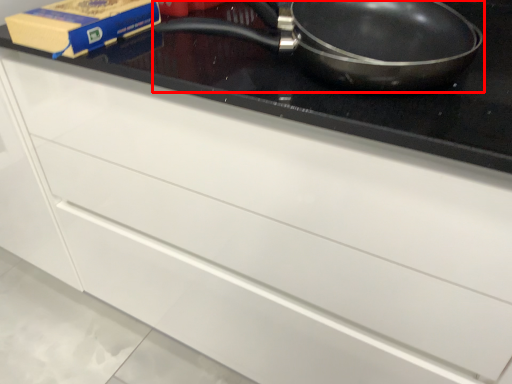
Question: From the image's perspective, considering the relative positions of frying pan (annotated by the red box) and paperback book in the image provided, where is frying pan (annotated by the red box) located with respect to the staircase?

Choices:
 (A) above
 (B) below

Answer: (B)